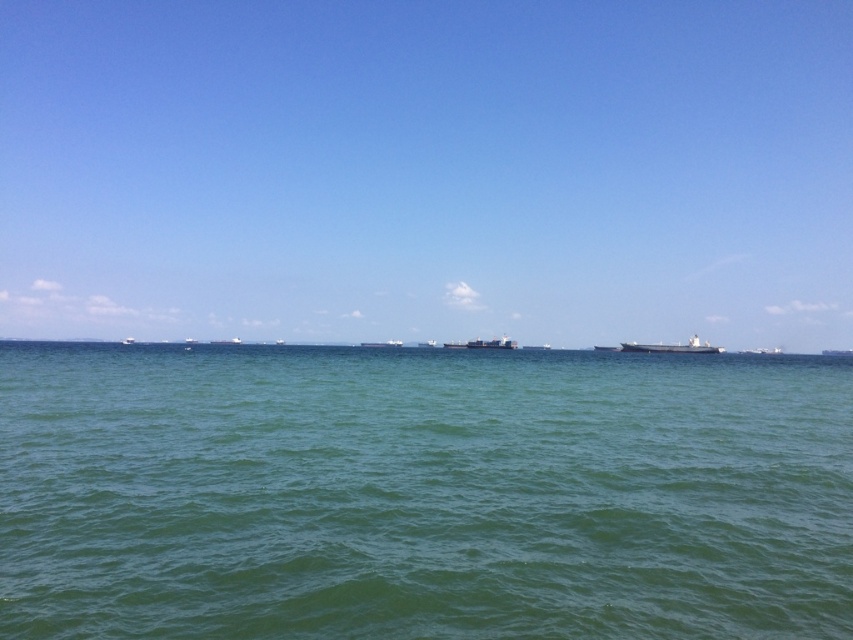
Question: Can you confirm if metallic gray ship at right is wider than metallic gray cargo ship at center?

Choices:
 (A) yes
 (B) no

Answer: (A)

Question: Does green water at center appear over metallic gray cargo ship at center?

Choices:
 (A) yes
 (B) no

Answer: (A)

Question: Among these points, which one is nearest to the camera?

Choices:
 (A) (514, 348)
 (B) (695, 336)

Answer: (A)

Question: Which point is farther from the camera taking this photo?

Choices:
 (A) (459, 342)
 (B) (699, 349)

Answer: (A)

Question: Does green water at center lie behind metallic gray ship at right?

Choices:
 (A) no
 (B) yes

Answer: (A)

Question: Which of these objects is positioned closest to the green water at center?

Choices:
 (A) metallic gray ship at center
 (B) metallic gray ship at right
 (C) metallic gray cargo ship at center

Answer: (B)